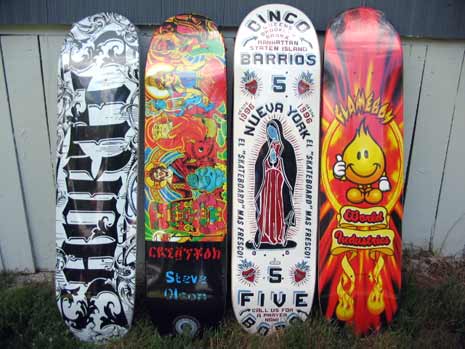
I want to click on brown carpet, so click(x=432, y=302).